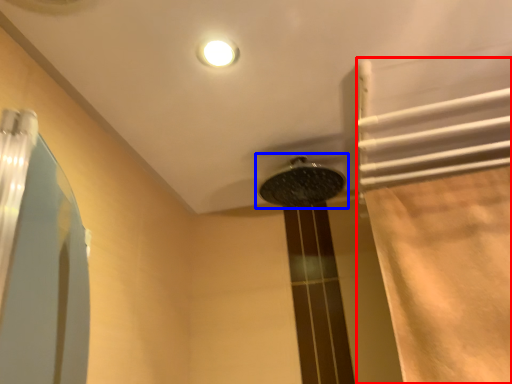
Question: Which object appears farthest to the camera in this image, shower curtain (highlighted by a red box) or shower (highlighted by a blue box)?

Choices:
 (A) shower curtain
 (B) shower

Answer: (B)